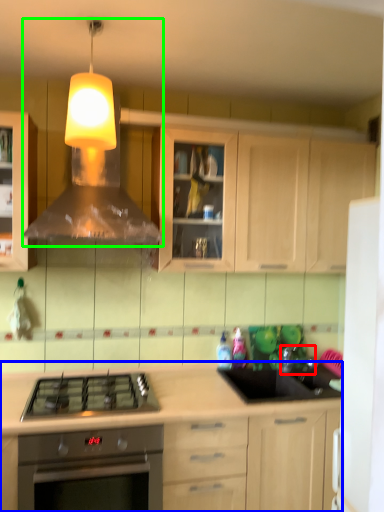
Question: Which object is positioned farthest from faucet (highlighted by a red box)? Select from cabinetry (highlighted by a blue box) and vent (highlighted by a green box).

Choices:
 (A) cabinetry
 (B) vent

Answer: (B)